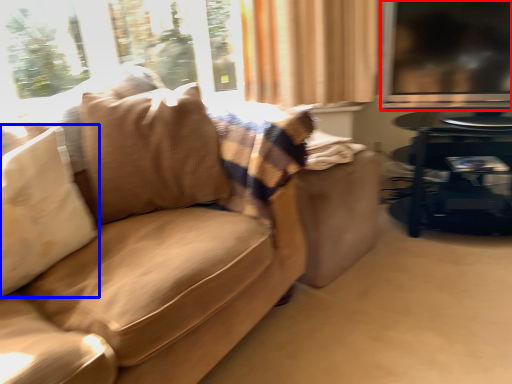
Question: Which of the following is the farthest to the observer, window screen (highlighted by a red box) or pillow (highlighted by a blue box)?

Choices:
 (A) window screen
 (B) pillow

Answer: (A)